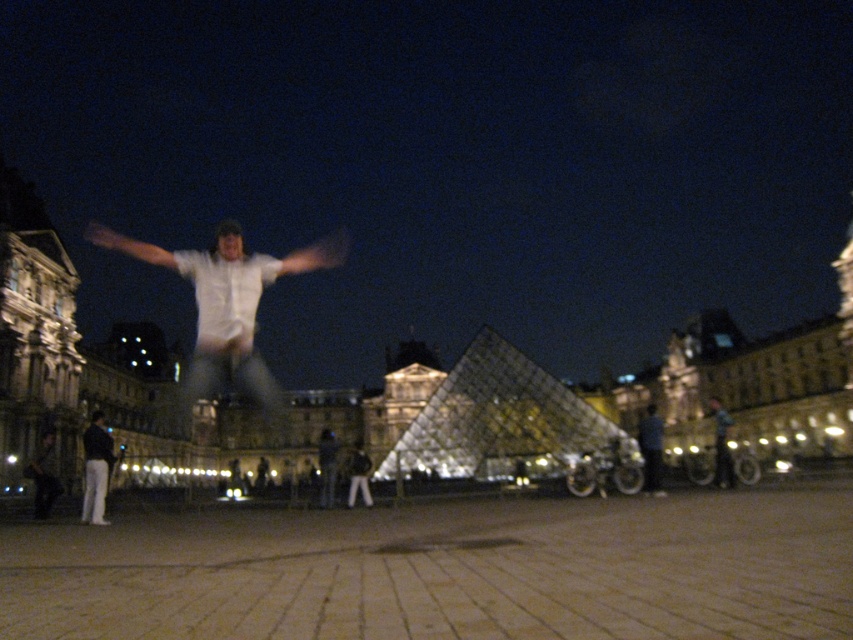
You are standing at the point marked as point (196, 304) in the image of the Louvre Museum at night. If you want to take a photo of the iconic glass pyramid, which is the main structure in the center, will you be able to see it clearly from your current position?

Yes, you will be able to see the iconic glass pyramid clearly from point (196, 304) because the distance between you and the camera is 717.37 feet, which is within a reasonable viewing distance for such a large structure.

You are a fashion designer analyzing the clothing items in the image. Which clothing item, the white matte shirt at center or the dark blue jeans at lower left, has a larger width measurement?

The white matte shirt at center might be wider than dark blue jeans at lower left according to the description.

Consider the image. You are standing at the Louvre Museum and want to place a small statue exactly halfway between the two points marked as point (108, 243) and point (103, 481). Will the statue be closer to the pyramid or the person jumping?

The statue will be closer to the pyramid because point (108, 243) is closer to the pyramid than point (103, 481). Since the statue is placed halfway between them, it remains nearer to the pyramid than the jumping person.